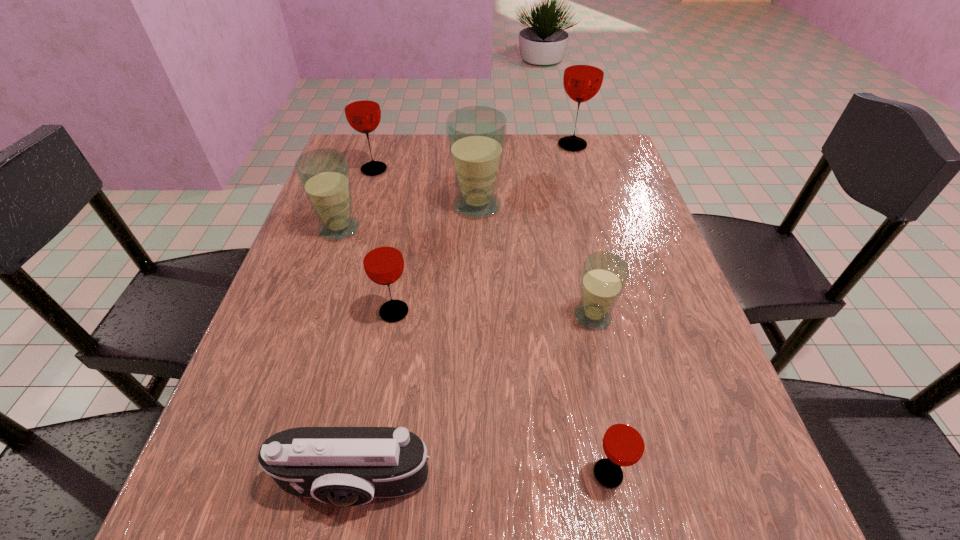
This screenshot has height=540, width=960. I want to click on free spot located 0.390m on the back of the nearest blue glass, so 564,187.

Locate an element on the screen. glass positioned at the near edge is located at coordinates (624, 442).

Where is `camera at the near edge`? camera at the near edge is located at coordinates (344, 466).

Where is `camera that is at the left edge`? This screenshot has height=540, width=960. camera that is at the left edge is located at coordinates (344, 466).

Where is `object that is at the far left corner`? The width and height of the screenshot is (960, 540). object that is at the far left corner is located at coordinates click(362, 110).

Find the location of a particular element. object located in the near left corner section of the desktop is located at coordinates (344, 466).

Locate an element on the screen. The width and height of the screenshot is (960, 540). object that is at the far right corner is located at coordinates (583, 76).

Identify the location of vacant space at the far edge. The image size is (960, 540). (410, 141).

Locate an element on the screen. vacant space at the left edge of the desktop is located at coordinates (316, 302).

Identify the location of vacant space at the right edge of the desktop. (627, 351).